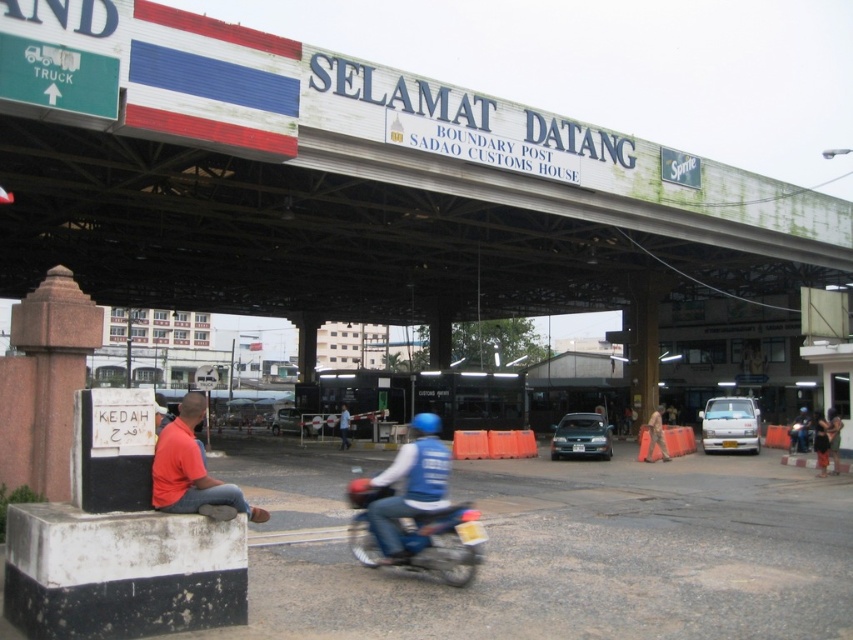
Does point (838, 460) lie behind point (340, 445)?

No, it is not.

Between blue denim jeans at lower center and blue helmet at center, which one has more height?

blue denim jeans at lower center is taller.

Is point (836, 449) more distant than point (341, 444)?

No, it is in front of (341, 444).

Find the location of a particular element. The image size is (853, 640). blue denim jeans at lower center is located at coordinates (834, 436).

Can you confirm if blue fabric helmet at center is positioned below blue helmet at center?

Incorrect, blue fabric helmet at center is not positioned below blue helmet at center.

Does blue fabric helmet at center appear on the left side of blue helmet at center?

Incorrect, blue fabric helmet at center is not on the left side of blue helmet at center.

At what (x,y) coordinates should I click in order to perform the action: click on blue fabric helmet at center. Please return your answer as a coordinate pair (x, y). Looking at the image, I should click on (410, 484).

Is orange shirt at lower left below blue denim jeans at lower center?

No, orange shirt at lower left is not below blue denim jeans at lower center.

Does orange shirt at lower left come behind blue denim jeans at lower center?

No, it is not.

In order to click on orange shirt at lower left in this screenshot , I will do `click(190, 468)`.